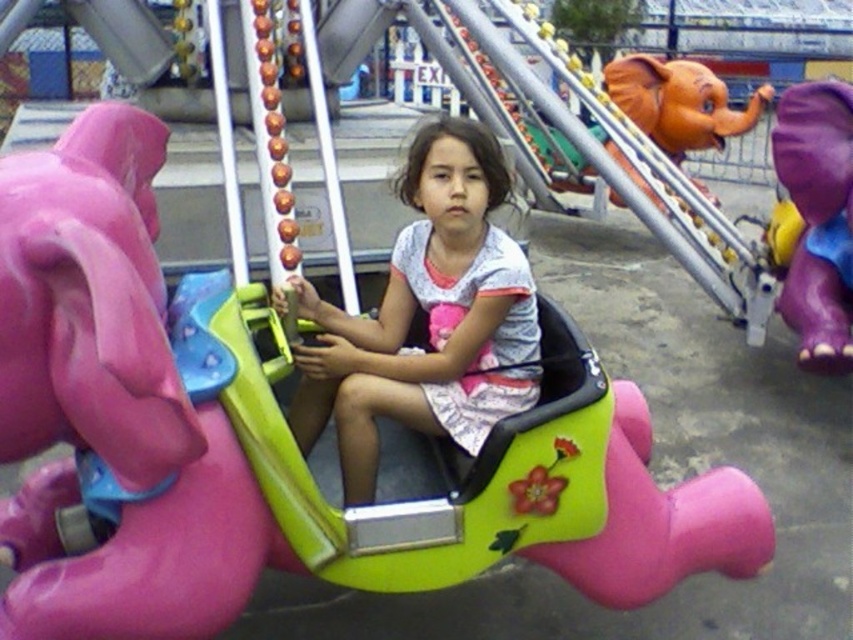
Question: Based on their relative distances, which object is nearer to the purple matte elephant at right?

Choices:
 (A) orange matte elephant head at upper right
 (B) matte plastic child at center

Answer: (B)

Question: Estimate the real-world distances between objects in this image. Which object is closer to the matte plastic child at center?

Choices:
 (A) orange matte elephant head at upper right
 (B) purple matte elephant at right

Answer: (B)

Question: Which of the following is the closest to the observer?

Choices:
 (A) purple matte elephant at right
 (B) matte plastic child at center

Answer: (B)

Question: Does matte plastic child at center have a lesser width compared to purple matte elephant at right?

Choices:
 (A) yes
 (B) no

Answer: (B)

Question: Does matte plastic child at center appear over purple matte elephant at right?

Choices:
 (A) no
 (B) yes

Answer: (A)

Question: Is the position of matte plastic child at center less distant than that of orange matte elephant head at upper right?

Choices:
 (A) no
 (B) yes

Answer: (B)